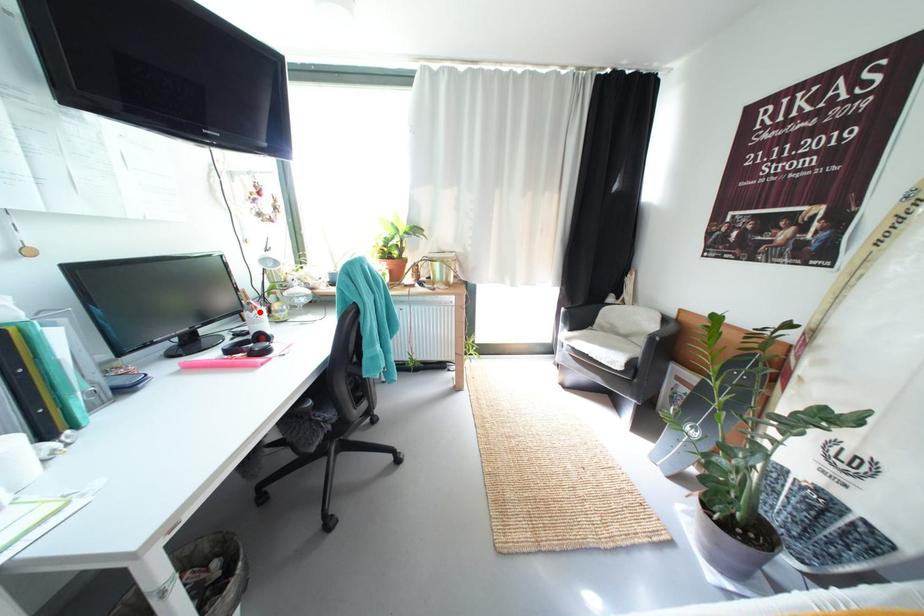
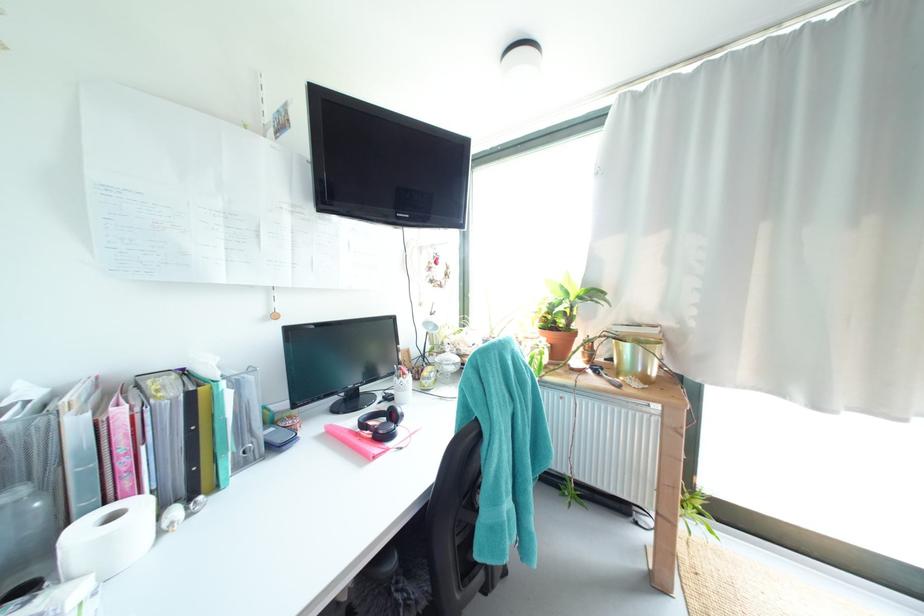
Where in the second image is the point corresponding to the highlighted location from the first image?

(407, 379)